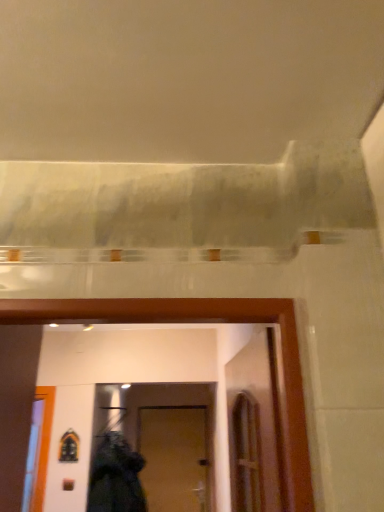
Question: Does wooden door at center appear on the left side of black fabric at lower center?

Choices:
 (A) no
 (B) yes

Answer: (A)

Question: Is wooden door at center completely or partially outside of black fabric at lower center?

Choices:
 (A) yes
 (B) no

Answer: (A)

Question: Can black fabric at lower center be found inside wooden door at center?

Choices:
 (A) no
 (B) yes

Answer: (A)

Question: Does wooden door at center come behind black fabric at lower center?

Choices:
 (A) no
 (B) yes

Answer: (B)

Question: Is wooden door at center not close to black fabric at lower center?

Choices:
 (A) no
 (B) yes

Answer: (A)

Question: Considering the relative positions of wooden door at center and black fabric at lower center in the image provided, is wooden door at center in front of black fabric at lower center?

Choices:
 (A) yes
 (B) no

Answer: (B)

Question: Can you confirm if black fabric at lower center is wider than wooden door at center?

Choices:
 (A) yes
 (B) no

Answer: (A)

Question: Is black fabric at lower center with wooden door at center?

Choices:
 (A) yes
 (B) no

Answer: (B)

Question: From the image's perspective, would you say black fabric at lower center is shown under wooden door at center?

Choices:
 (A) no
 (B) yes

Answer: (A)

Question: Does black fabric at lower center have a greater height compared to wooden door at center?

Choices:
 (A) yes
 (B) no

Answer: (B)

Question: From a real-world perspective, is black fabric at lower center positioned under wooden door at center based on gravity?

Choices:
 (A) yes
 (B) no

Answer: (B)

Question: Is black fabric at lower center further to the viewer compared to wooden door at center?

Choices:
 (A) yes
 (B) no

Answer: (B)

Question: In terms of width, does black fabric at lower center look wider or thinner when compared to wooden door at center?

Choices:
 (A) thin
 (B) wide

Answer: (B)